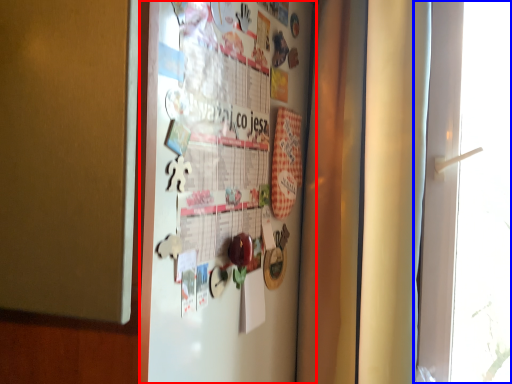
Question: Which of the following is the closest to the observer, fridge (highlighted by a red box) or window (highlighted by a blue box)?

Choices:
 (A) fridge
 (B) window

Answer: (A)